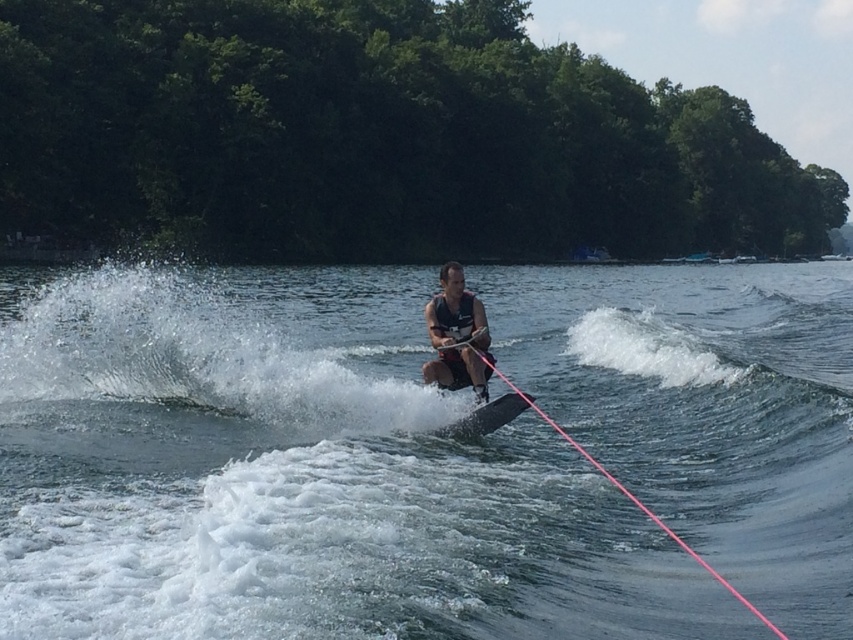
Question: Does green leafy trees at upper center have a larger size compared to black fabric life jacket at center?

Choices:
 (A) no
 (B) yes

Answer: (B)

Question: Is green leafy trees at upper center further to camera compared to black fabric life jacket at center?

Choices:
 (A) yes
 (B) no

Answer: (A)

Question: Is clear water at center smaller than black matte water ski at center?

Choices:
 (A) yes
 (B) no

Answer: (B)

Question: Which of the following is the farthest from the observer?

Choices:
 (A) matte black life vest at center
 (B) pink nylon rope at center
 (C) black fabric life jacket at center
 (D) clear water at center

Answer: (C)

Question: Which object appears farthest from the camera in this image?

Choices:
 (A) black matte water ski at center
 (B) green leafy trees at upper center
 (C) clear water at center

Answer: (B)

Question: Which of the following is the farthest from the observer?

Choices:
 (A) (527, 403)
 (B) (111, 465)

Answer: (A)